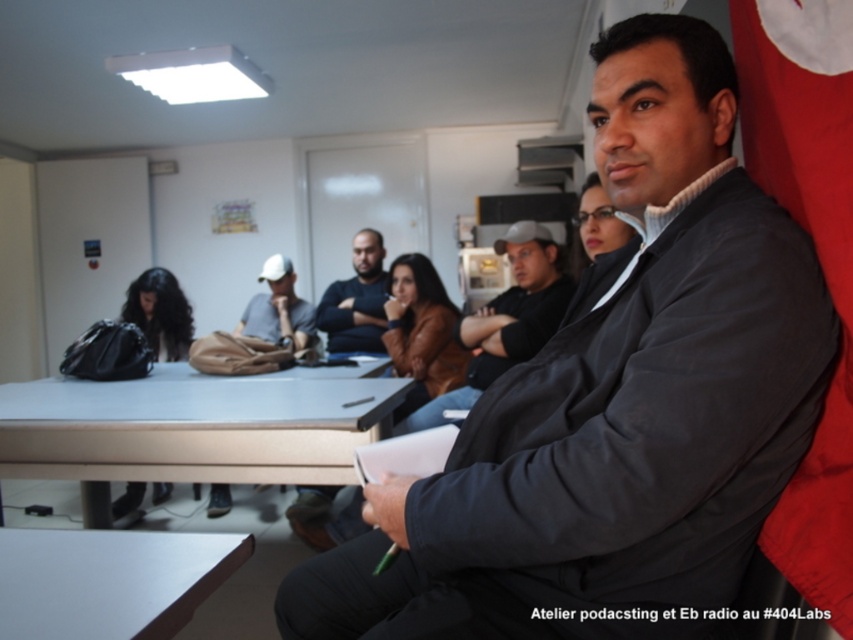
Question: Can you confirm if red fabric flag at right is smaller than white matte table at lower left?

Choices:
 (A) no
 (B) yes

Answer: (A)

Question: Which of these objects is positioned closest to the matte black jacket at center?

Choices:
 (A) black leather bag at lower left
 (B) metallic gray table at lower center
 (C) white matte table at lower left

Answer: (B)

Question: Estimate the real-world distances between objects in this image. Which object is farther from the matte black jacket at center?

Choices:
 (A) dark gray jacket at center
 (B) brown leather jacket at center
 (C) dark gray sweater at center
 (D) metallic gray table at lower center

Answer: (A)

Question: Does white matte table at lower left have a lesser width compared to brown leather jacket at center?

Choices:
 (A) no
 (B) yes

Answer: (A)

Question: Can you confirm if white matte table at lower left is positioned to the left of dark gray sweater at center?

Choices:
 (A) no
 (B) yes

Answer: (A)

Question: Among these objects, which one is nearest to the camera?

Choices:
 (A) white matte table at lower left
 (B) dark gray jacket at center

Answer: (B)